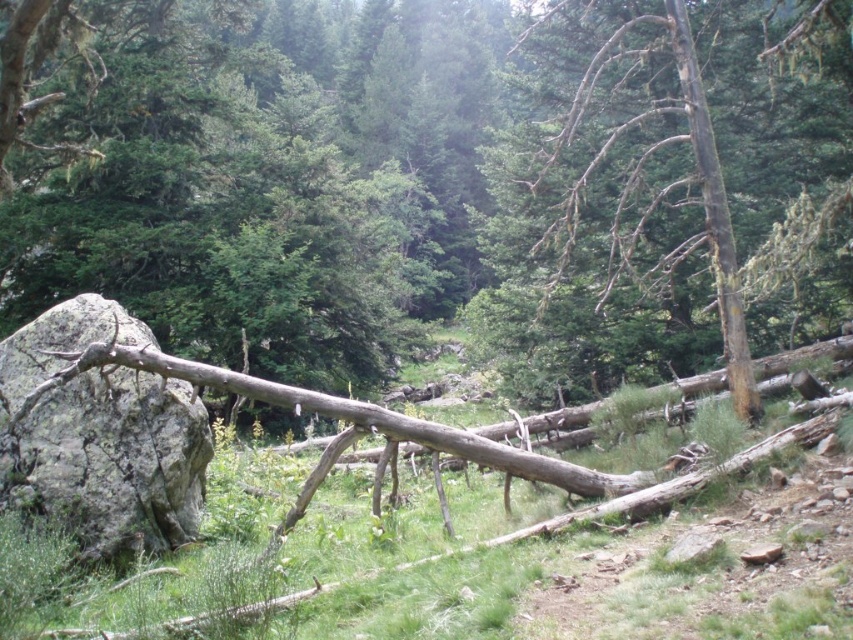
Consider the image. You are a park ranger assessing the forest for potential fire hazards. You notice the brown rough tree trunk at center and the charcoal gray bark tree at right. Which tree has a trunk that could pose a greater risk due to its width?

The brown rough tree trunk at center might be wider than charcoal gray bark tree at right, so it could pose a greater fire hazard due to its larger diameter.

Based on the photo, you are standing in the forest scene described. If you want to walk to the brown rough tree trunk at center, which direction should you head relative to your current position?

The brown rough tree trunk at center is located at the coordinates (434, 184) in the image, so you should head towards the center of the scene to reach it.

You are a hiker trying to cross a narrow path between two trees. The path is between the brown rough tree trunk at center and the charcoal gray bark tree at right. Which tree should you avoid touching if you want to stay on the path?

The brown rough tree trunk at center has a larger size compared to the charcoal gray bark tree at right, so you should avoid touching the brown rough tree trunk at center to stay on the path.